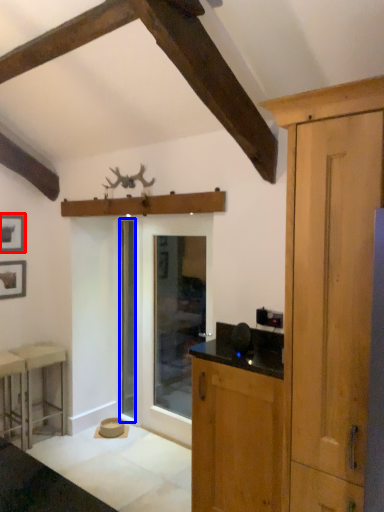
Question: Among these objects, which one is nearest to the camera, picture frame (highlighted by a red box) or screen door (highlighted by a blue box)?

Choices:
 (A) picture frame
 (B) screen door

Answer: (A)